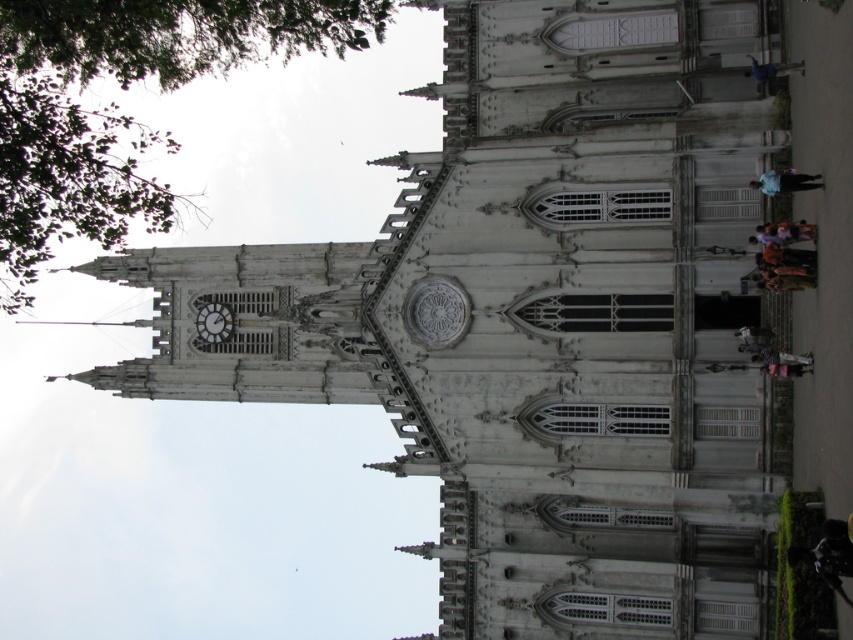
You are standing in front of the Gothic building and see a light blue shirt at right and a dark brown leather jacket at lower right. Which of these two items is positioned more to the right side?

The light blue shirt at right is positioned more to the right side than the dark brown leather jacket at lower right.

You are standing in front of the Gothic building and notice two people wearing the light blue shirt at right and dark brown leather jacket at lower right. Which person is shorter?

The light blue shirt at right is not as tall as dark brown leather jacket at lower right, so the person wearing the light blue shirt at right is shorter.